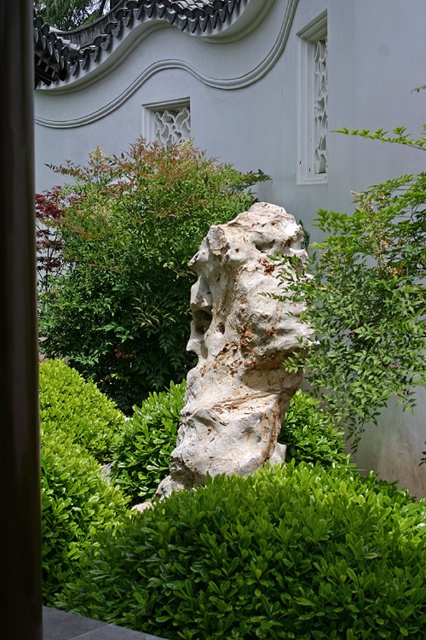
You are a gardener planning to place a new decorative item in the garden. You have a 1.2 meter wide decorative item. The white stone sculpture at center and the white rough stone at center are already present. Which existing stone can the new item fit next to without exceeding its width?

The new decorative item with a width of 1.2 meters can fit next to the white rough stone at center because the white stone sculpture at center is wider than the white rough stone at center.

You are a gardener who wants to plant a new flower bed between the green leafy hedge at center and the white stone sculpture at center. Since the flower bed requires a minimum height of 30 cm to grow properly, can you determine which object you should place the flower bed closer to?

The green leafy hedge at center is taller than the white stone sculpture at center, so you should place the flower bed closer to the white stone sculpture at center to ensure it meets the minimum height requirement.

You are a visitor in this garden and want to take a photo of both the white stone sculpture at center and the smooth brown pole at left. Since you want both objects to be clearly visible in the frame, will you need to adjust your camera angle to account for their heights?

The white stone sculpture at center is shorter than the smooth brown pole at left. To ensure both are visible, you should angle the camera slightly downward to capture the shorter sculpture and still include the top of the taller pole.